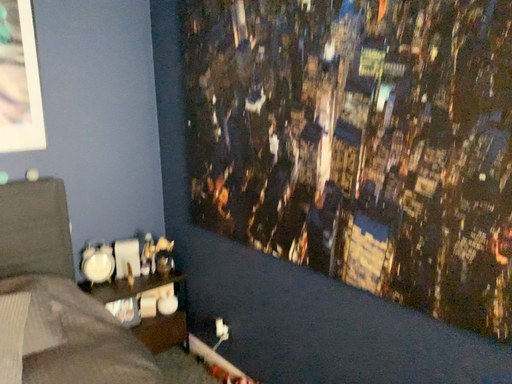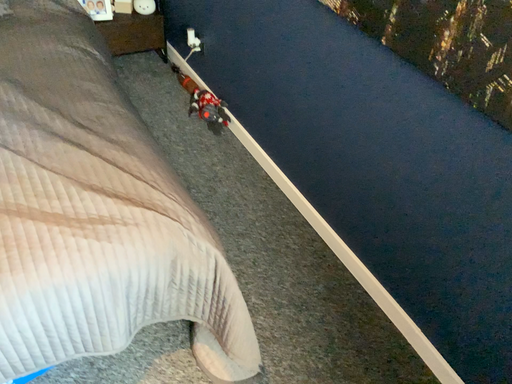
Question: Which way did the camera rotate in the video?

Choices:
 (A) rotated left
 (B) rotated right

Answer: (A)